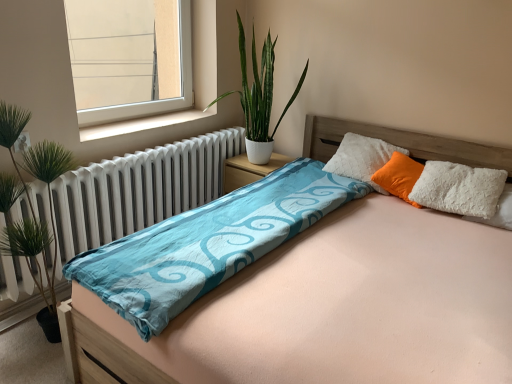
Describe the element at coordinates (138, 190) in the screenshot. I see `white metallic radiator at left` at that location.

In order to click on white metallic radiator at left in this screenshot , I will do `click(138, 190)`.

Image resolution: width=512 pixels, height=384 pixels. Describe the element at coordinates (399, 176) in the screenshot. I see `orange soft pillow at upper right` at that location.

The height and width of the screenshot is (384, 512). What do you see at coordinates (141, 124) in the screenshot?
I see `white smooth window sill at upper left` at bounding box center [141, 124].

The height and width of the screenshot is (384, 512). What are the coordinates of `green glossy plant at upper center, which appears as the second vegetation when viewed from the left` in the screenshot? It's located at point(259,88).

How different are the orientations of green glossy plant at upper center, which appears as the second vegetation when viewed from the left, and white smooth window sill at upper left in degrees?

The facing directions of green glossy plant at upper center, which appears as the second vegetation when viewed from the left, and white smooth window sill at upper left are 91.1 degrees apart.

Is green glossy plant at upper center, which appears as the second vegetation when viewed from the left, at the left side of white smooth window sill at upper left?

Incorrect, green glossy plant at upper center, which appears as the second vegetation when viewed from the left, is not on the left side of white smooth window sill at upper left.

Which of these two, green glossy plant at upper center, the 1th vegetation viewed from the right, or white smooth window sill at upper left, is thinner?

Thinner between the two is white smooth window sill at upper left.

From the image's perspective, relative to white smooth window sill at upper left, is green glossy plant at upper center, positioned as the first vegetation in back-to-front order, above or below?

From the image's perspective, green glossy plant at upper center, positioned as the first vegetation in back-to-front order, appears above white smooth window sill at upper left.

Choose the correct answer: Is green glossy plant at upper center, positioned as the first vegetation in back-to-front order, inside green leafy plant at left, the first vegetation viewed from the left, or outside it?

green glossy plant at upper center, positioned as the first vegetation in back-to-front order, is not enclosed by green leafy plant at left, the first vegetation viewed from the left.

Is green glossy plant at upper center, positioned as the first vegetation in back-to-front order, facing away from green leafy plant at left, acting as the first vegetation starting from the front?

No, green leafy plant at left, acting as the first vegetation starting from the front, is not at the back of green glossy plant at upper center, positioned as the first vegetation in back-to-front order.

Can you tell me how much green glossy plant at upper center, which appears as the second vegetation when viewed from the left, and green leafy plant at left, the second vegetation positioned from the right, differ in facing direction?

The angular difference between green glossy plant at upper center, which appears as the second vegetation when viewed from the left, and green leafy plant at left, the second vegetation positioned from the right, is 98.1 degrees.

Based on the photo, from a real-world perspective, between green glossy plant at upper center, positioned as the first vegetation in back-to-front order, and green leafy plant at left, acting as the first vegetation starting from the front, who is vertically lower?

From a 3D spatial view, green leafy plant at left, acting as the first vegetation starting from the front, is below.

How different are the orientations of white smooth window sill at upper left and white matte nightstand at center in degrees?

88.8 degrees.

From the image's perspective, relative to white matte nightstand at center, is white smooth window sill at upper left above or below?

Based on their image positions, white smooth window sill at upper left is located above white matte nightstand at center.

Is white smooth window sill at upper left turned away from white matte nightstand at center?

No, white smooth window sill at upper left is not facing the opposite direction of white matte nightstand at center.

Between white smooth window sill at upper left and white matte nightstand at center, which one has larger size?

Bigger between the two is white matte nightstand at center.

Consider the image. Is green glossy plant at upper center, which appears as the second vegetation when viewed from the left, further to camera compared to orange soft pillow at upper right?

That is False.

Considering the points (260, 70) and (395, 193), which point is behind, point (260, 70) or point (395, 193)?

Point (260, 70)

Consider the image. How far apart are green glossy plant at upper center, which appears as the second vegetation when viewed from the left, and orange soft pillow at upper right?

They are 37.23 inches apart.

Which object is wider, green glossy plant at upper center, the 1th vegetation viewed from the right, or orange soft pillow at upper right?

green glossy plant at upper center, the 1th vegetation viewed from the right, is wider.

Considering the positions of point (245, 178) and point (267, 69), is point (245, 178) closer or farther from the camera than point (267, 69)?

Point (245, 178) is positioned farther from the camera compared to point (267, 69).

Find the location of a particular element. vegetation located above the white matte nightstand at center (from the image's perspective) is located at coordinates (259, 88).

Is white matte nightstand at center to the left of green glossy plant at upper center, which appears as the second vegetation when viewed from the left, from the viewer's perspective?

Correct, you'll find white matte nightstand at center to the left of green glossy plant at upper center, which appears as the second vegetation when viewed from the left.

From the picture: Can you see white matte nightstand at center touching green glossy plant at upper center, which appears as the second vegetation when viewed from the left?

There is a gap between white matte nightstand at center and green glossy plant at upper center, which appears as the second vegetation when viewed from the left.

Considering the relative positions of light pink fabric bed at center and transparent glass window at upper left in the image provided, is light pink fabric bed at center to the right of transparent glass window at upper left from the viewer's perspective?

Correct, you'll find light pink fabric bed at center to the right of transparent glass window at upper left.

Is light pink fabric bed at center bigger than transparent glass window at upper left?

Indeed, light pink fabric bed at center has a larger size compared to transparent glass window at upper left.

Measure the distance from light pink fabric bed at center to transparent glass window at upper left.

They are 3.65 meters apart.

Based on the photo, does light pink fabric bed at center have a lesser width compared to transparent glass window at upper left?

No, light pink fabric bed at center is not thinner than transparent glass window at upper left.

Which object is closer to the camera, white metallic radiator at left or green glossy plant at upper center, the 1th vegetation viewed from the right?

Positioned in front is white metallic radiator at left.

Is white metallic radiator at left to the left or to the right of green glossy plant at upper center, the second vegetation in the front-to-back sequence, in the image?

From the image, it's evident that white metallic radiator at left is to the left of green glossy plant at upper center, the second vegetation in the front-to-back sequence.

Based on the photo, from a real-world perspective, which is physically below, white metallic radiator at left or green glossy plant at upper center, the second vegetation in the front-to-back sequence?

From a 3D spatial view, white metallic radiator at left is below.

This screenshot has height=384, width=512. What are the coordinates of `radiator below the green glossy plant at upper center, which appears as the second vegetation when viewed from the left (from the image's perspective)` in the screenshot? It's located at (138, 190).

Where is `vegetation on the right of white smooth window sill at upper left`? The width and height of the screenshot is (512, 384). vegetation on the right of white smooth window sill at upper left is located at coordinates (259, 88).

At what (x,y) coordinates should I click in order to perform the action: click on vegetation located behind the green leafy plant at left, acting as the first vegetation starting from the front. Please return your answer as a coordinate pair (x, y). The width and height of the screenshot is (512, 384). Looking at the image, I should click on (259, 88).

When comparing their distances from white smooth window sill at upper left, does orange soft pillow at upper right or green glossy plant at upper center, the 1th vegetation viewed from the right, seem closer?

Among the two, green glossy plant at upper center, the 1th vegetation viewed from the right, is located nearer to white smooth window sill at upper left.

Considering their positions, is white metallic radiator at left positioned closer to transparent glass window at upper left than green glossy plant at upper center, the second vegetation in the front-to-back sequence?

green glossy plant at upper center, the second vegetation in the front-to-back sequence, is positioned closer to the anchor transparent glass window at upper left.

When comparing their distances from white metallic radiator at left, does white smooth window sill at upper left or orange soft pillow at upper right seem further?

Among the two, orange soft pillow at upper right is located further to white metallic radiator at left.

From the image, which object appears to be nearer to white smooth window sill at upper left, white metallic radiator at left or white matte nightstand at center?

Based on the image, white metallic radiator at left appears to be nearer to white smooth window sill at upper left.

From the image, which object appears to be nearer to light pink fabric bed at center, transparent glass window at upper left or green glossy plant at upper center, which appears as the second vegetation when viewed from the left?

green glossy plant at upper center, which appears as the second vegetation when viewed from the left.

From the image, which object appears to be nearer to transparent glass window at upper left, green glossy plant at upper center, the 1th vegetation viewed from the right, or white metallic radiator at left?

green glossy plant at upper center, the 1th vegetation viewed from the right.

Based on the photo, from the image, which object appears to be farther from white smooth window sill at upper left, transparent glass window at upper left or white metallic radiator at left?

transparent glass window at upper left is positioned further to the anchor white smooth window sill at upper left.

Considering their positions, is green leafy plant at left, the first vegetation viewed from the left, positioned further to white smooth window sill at upper left than green glossy plant at upper center, the second vegetation in the front-to-back sequence?

Based on the image, green leafy plant at left, the first vegetation viewed from the left, appears to be further to white smooth window sill at upper left.

At what (x,y) coordinates should I click in order to perform the action: click on window located between light pink fabric bed at center and green glossy plant at upper center, the 1th vegetation viewed from the right, in the depth direction. Please return your answer as a coordinate pair (x, y). Looking at the image, I should click on (128, 58).

Find the location of a particular element. radiator between green leafy plant at left, the second vegetation positioned from the right, and white smooth window sill at upper left from front to back is located at coordinates (138, 190).

Image resolution: width=512 pixels, height=384 pixels. What are the coordinates of `radiator between transparent glass window at upper left and green leafy plant at left, the second vegetation positioned from the right, from top to bottom` in the screenshot? It's located at (138, 190).

You are a GUI agent. You are given a task and a screenshot of the screen. Output one action in this format:
    pyautogui.click(x=<x>, y=<y>)
    Task: Click on the vegetation between transparent glass window at upper left and orange soft pillow at upper right in the horizontal direction
    
    Given the screenshot: What is the action you would take?
    pyautogui.click(x=259, y=88)